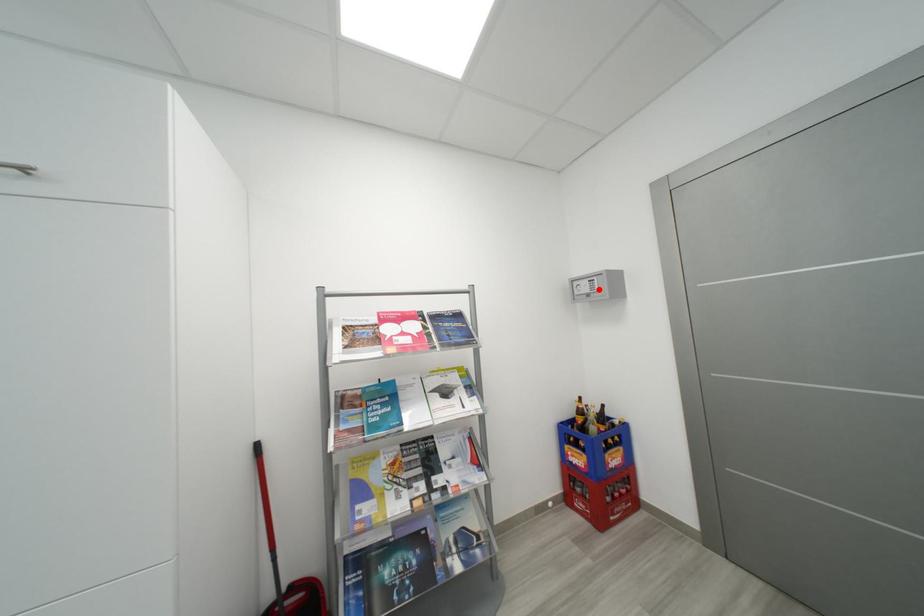
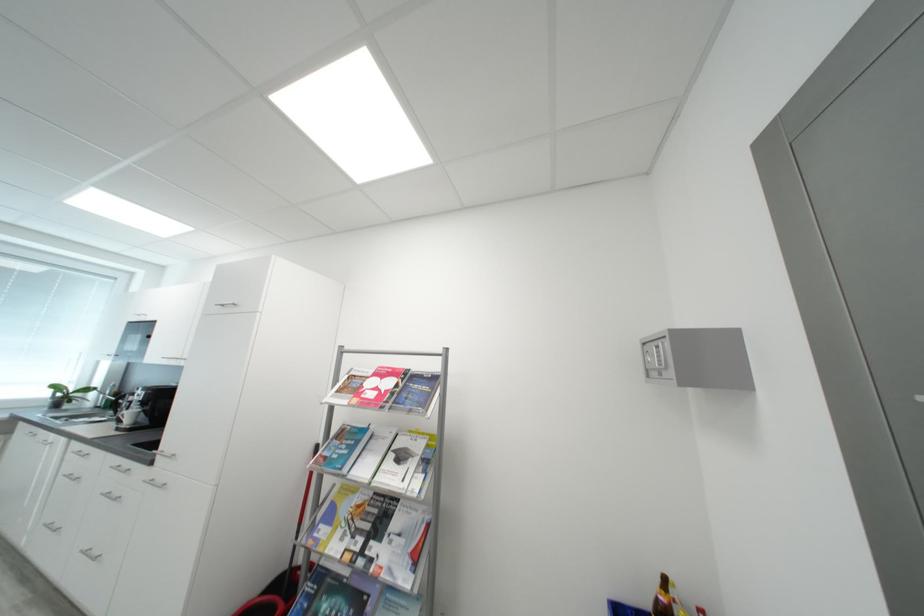
Find the pixel in the second image that matches the highlighted location in the first image.

(666, 362)